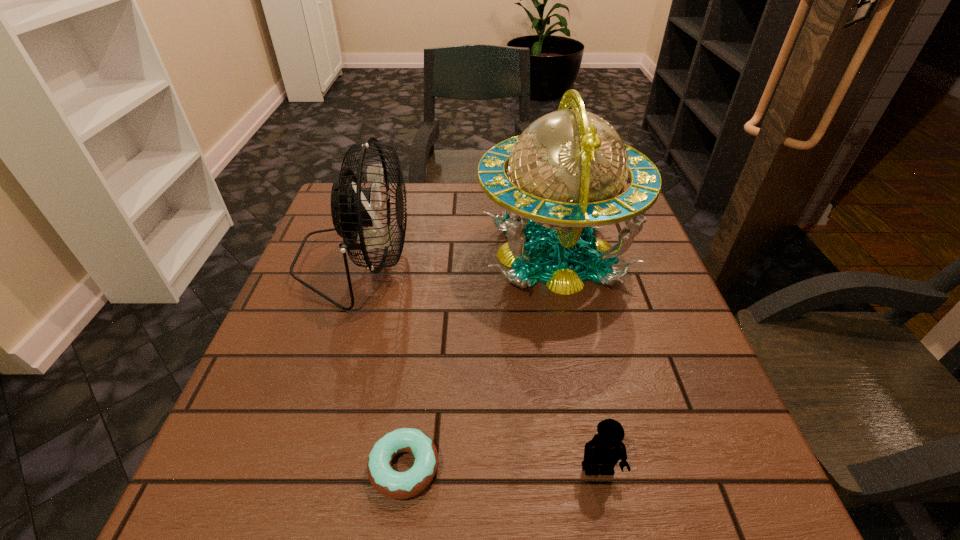
The height and width of the screenshot is (540, 960). I want to click on doughnut that is positioned at the near edge, so click(396, 485).

Where is `object positioned at the left edge`? object positioned at the left edge is located at coordinates (352, 207).

Find the location of a particular element. object situated at the right edge is located at coordinates (564, 176).

At what (x,y) coordinates should I click in order to perform the action: click on object that is at the far left corner. Please return your answer as a coordinate pair (x, y). This screenshot has width=960, height=540. Looking at the image, I should click on (352, 207).

Find the location of a particular element. The width and height of the screenshot is (960, 540). object that is at the far right corner is located at coordinates (564, 176).

At what (x,y) coordinates should I click in order to perform the action: click on free spot at the far edge of the desktop. Please return your answer as a coordinate pair (x, y). Looking at the image, I should click on (427, 185).

In the image, there is a desktop. At what (x,y) coordinates should I click in order to perform the action: click on vacant space at the near edge. Please return your answer as a coordinate pair (x, y). The image size is (960, 540). Looking at the image, I should click on (615, 497).

The width and height of the screenshot is (960, 540). What are the coordinates of `vacant space at the left edge of the desktop` in the screenshot? It's located at pos(324,285).

The width and height of the screenshot is (960, 540). In the image, there is a desktop. Find the location of `vacant space at the right edge`. vacant space at the right edge is located at coordinates (633, 334).

The image size is (960, 540). I want to click on vacant space at the near right corner, so click(x=696, y=489).